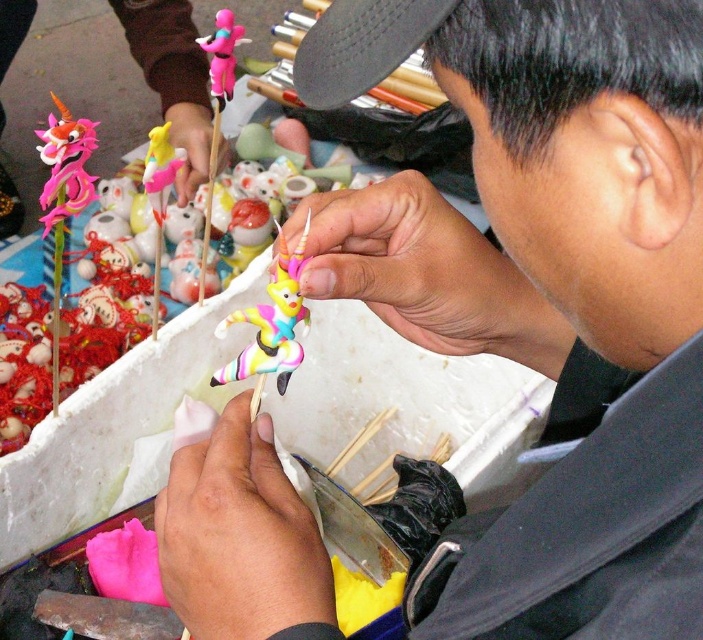
Question: Can you confirm if matte plastic unicorn at upper left is bigger than pink matte figurine at upper left?

Choices:
 (A) yes
 (B) no

Answer: (A)

Question: Among these points, which one is nearest to the camera?

Choices:
 (A) (273, 333)
 (B) (176, 10)

Answer: (A)

Question: Can you confirm if matte plastic unicorn at upper left is positioned to the right of black matte baseball cap at upper center?

Choices:
 (A) yes
 (B) no

Answer: (B)

Question: In this image, where is matte plastic unicorn at upper left located relative to pastel plastic toy at center?

Choices:
 (A) left
 (B) right

Answer: (A)

Question: Which of the following is the closest to the observer?

Choices:
 (A) black matte baseball cap at upper center
 (B) matte plastic unicorn at upper left
 (C) pastel plastic toy at center
 (D) pink matte figurine at upper left

Answer: (A)

Question: Among these points, which one is nearest to the camera?

Choices:
 (A) (283, 355)
 (B) (186, 42)
 (C) (412, 45)

Answer: (C)